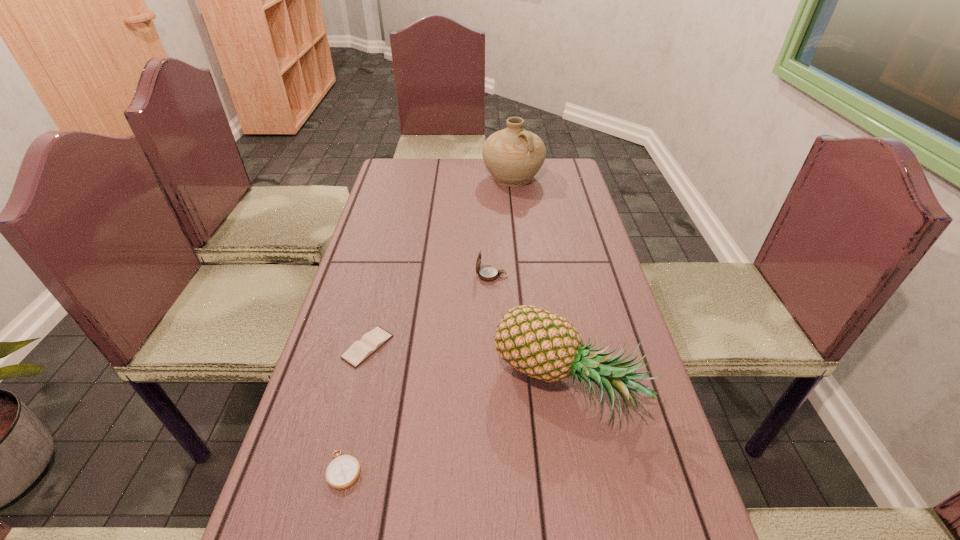
Find the location of `pottery`. pottery is located at coordinates (513, 156).

You are a GUI agent. You are given a task and a screenshot of the screen. Output one action in this format:
    pyautogui.click(x=<x>, y=<y>)
    Task: Click on the farthest object
    The image size is (960, 540).
    Given the screenshot: What is the action you would take?
    pyautogui.click(x=513, y=156)

The height and width of the screenshot is (540, 960). I want to click on the fourth shortest object, so click(543, 345).

What are the coordinates of `the right compass` in the screenshot? It's located at (487, 273).

Find the location of a particular element. This screenshot has height=540, width=960. the third shortest object is located at coordinates pos(487,273).

Where is `the left compass`? The image size is (960, 540). the left compass is located at coordinates (343, 471).

In order to click on the nearer compass in this screenshot , I will do `click(343, 471)`.

Locate an element on the screen. This screenshot has height=540, width=960. diary is located at coordinates (359, 351).

The width and height of the screenshot is (960, 540). I want to click on free space located on the left of the pottery, so click(397, 178).

Where is `vacant region located on the left of the second tallest object`? The image size is (960, 540). vacant region located on the left of the second tallest object is located at coordinates (461, 386).